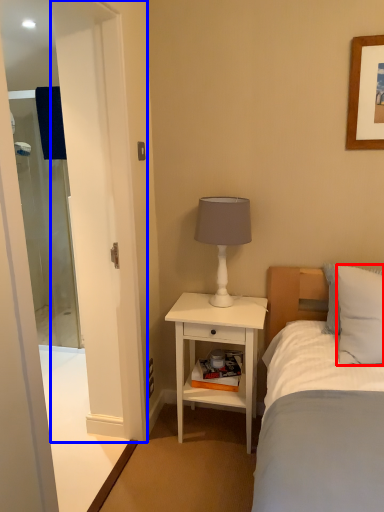
Question: Which point is closer to the camera, pillow (highlighted by a red box) or screen door (highlighted by a blue box)?

Choices:
 (A) pillow
 (B) screen door

Answer: (B)